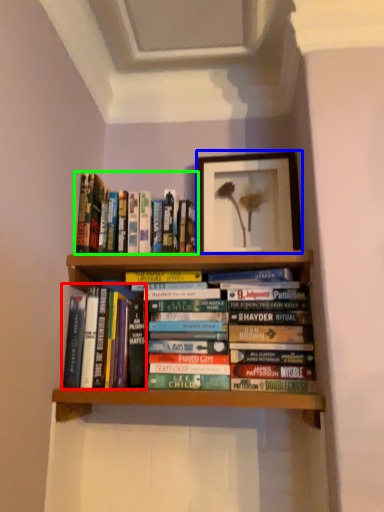
Question: Estimate the real-world distances between objects in this image. Which object is closer to book (highlighted by a red box), picture frame (highlighted by a blue box) or book (highlighted by a green box)?

Choices:
 (A) picture frame
 (B) book

Answer: (B)